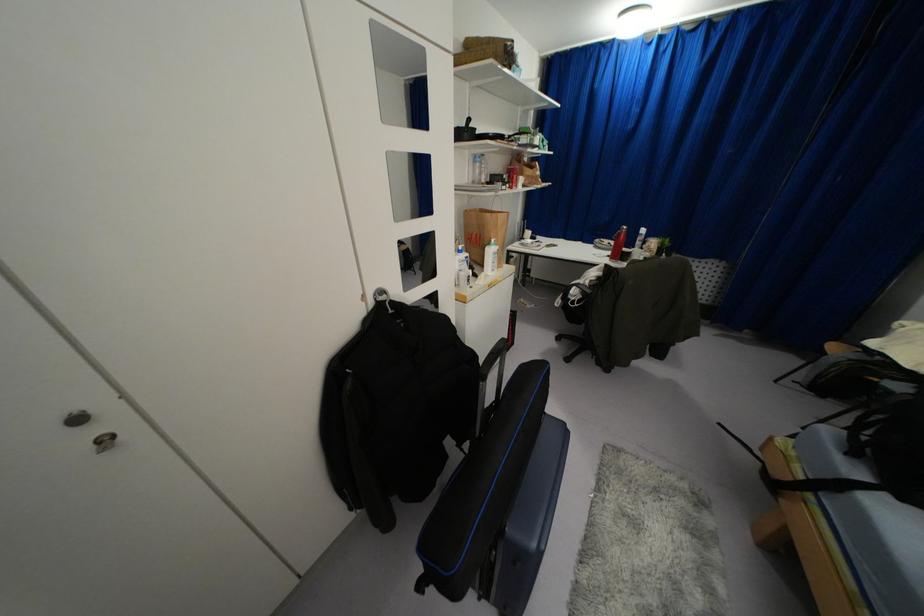
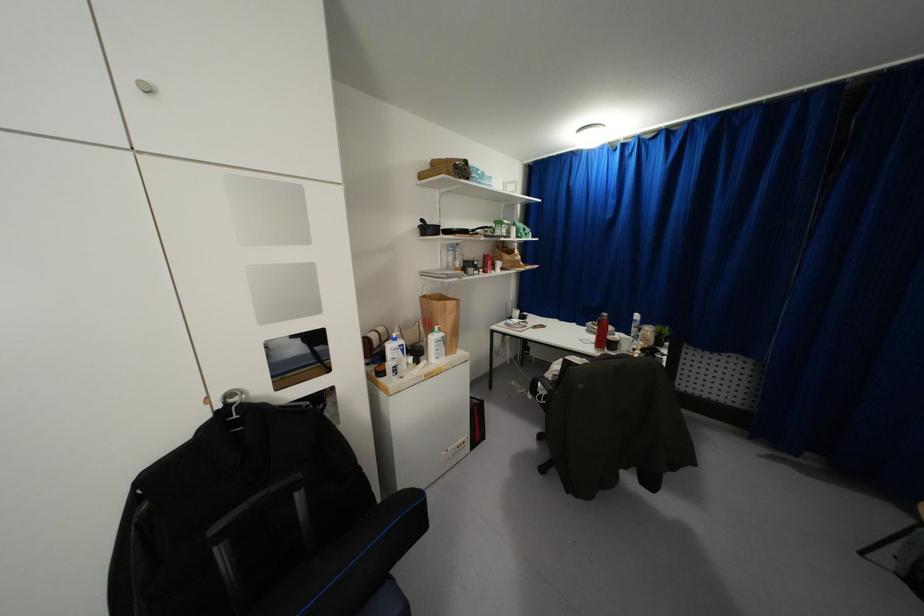
Question: In a continuous first-person perspective shot, in which direction is the camera moving?

Choices:
 (A) Left
 (B) Right
 (C) Forward
 (D) Backward

Answer: (B)